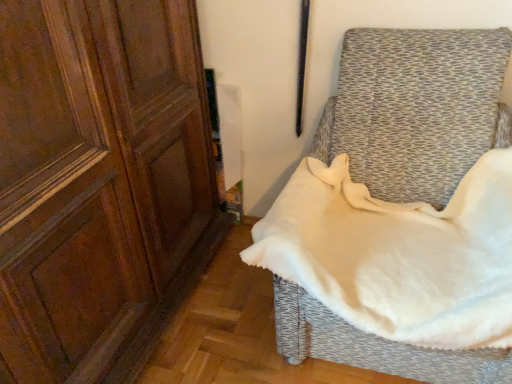
Question: Relative to white soft fabric at right, is matte wood screen door at left in front or behind?

Choices:
 (A) behind
 (B) front

Answer: (B)

Question: Considering the positions of matte wood screen door at left and white soft fabric at right in the image, is matte wood screen door at left wider or thinner than white soft fabric at right?

Choices:
 (A) wide
 (B) thin

Answer: (B)

Question: In terms of height, does matte wood screen door at left look taller or shorter compared to white soft fabric at right?

Choices:
 (A) short
 (B) tall

Answer: (B)

Question: Is white soft fabric at right inside or outside of matte wood screen door at left?

Choices:
 (A) outside
 (B) inside

Answer: (A)

Question: From a real-world perspective, relative to matte wood screen door at left, is white soft fabric at right vertically above or below?

Choices:
 (A) below
 (B) above

Answer: (A)

Question: Considering the positions of point (434, 349) and point (6, 324), is point (434, 349) closer or farther from the camera than point (6, 324)?

Choices:
 (A) closer
 (B) farther

Answer: (B)

Question: Considering the positions of white soft fabric at right and matte wood screen door at left in the image, is white soft fabric at right taller or shorter than matte wood screen door at left?

Choices:
 (A) short
 (B) tall

Answer: (A)